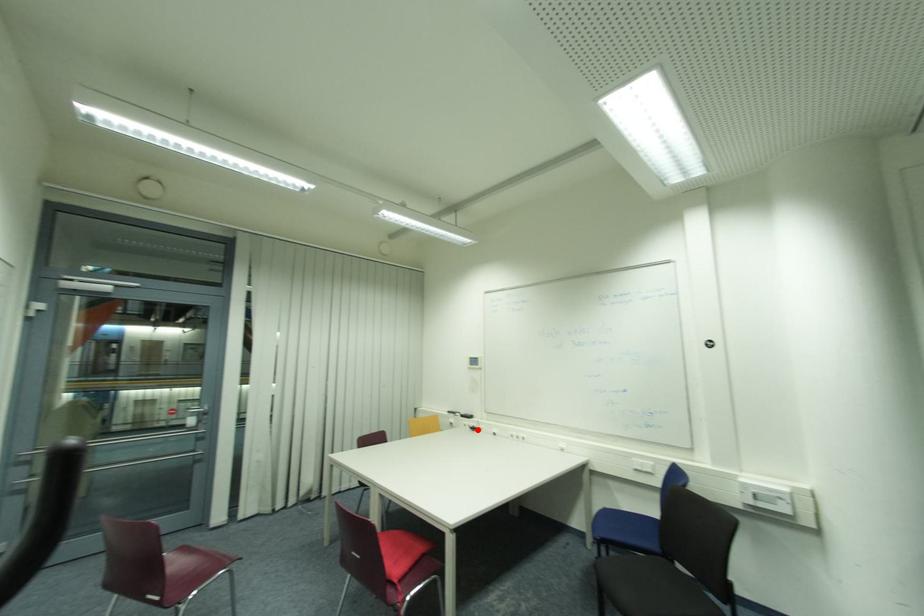
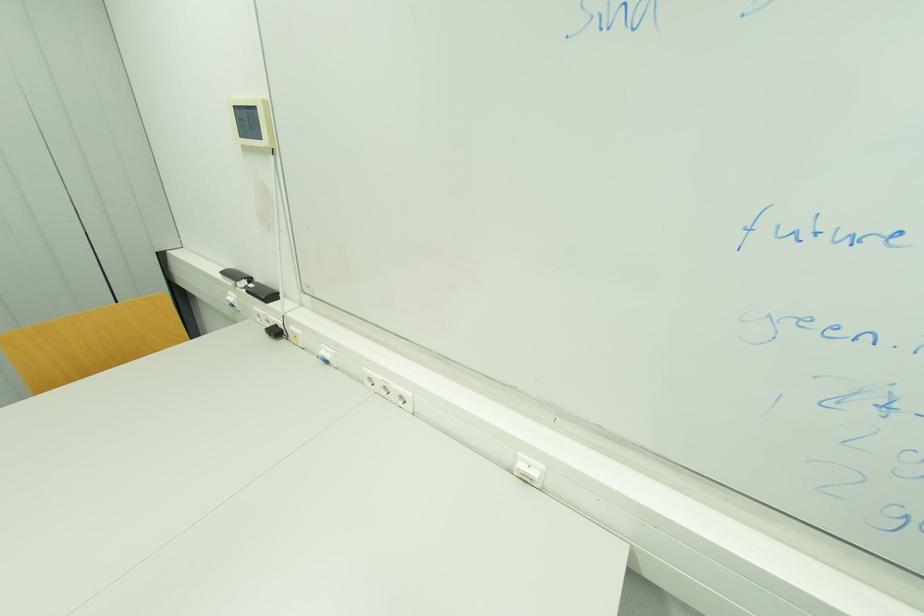
In the second image, find the point that corresponds to the highlighted location in the first image.

(281, 333)